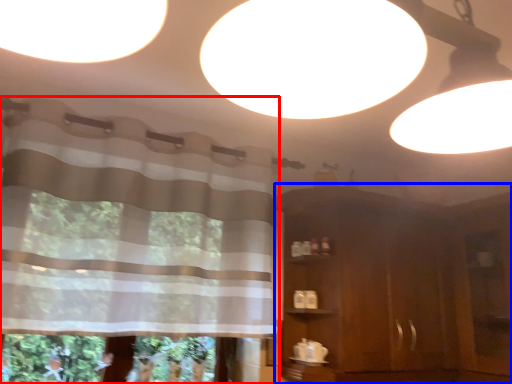
Question: Which object appears farthest to the camera in this image, curtain (highlighted by a red box) or dresser (highlighted by a blue box)?

Choices:
 (A) curtain
 (B) dresser

Answer: (B)